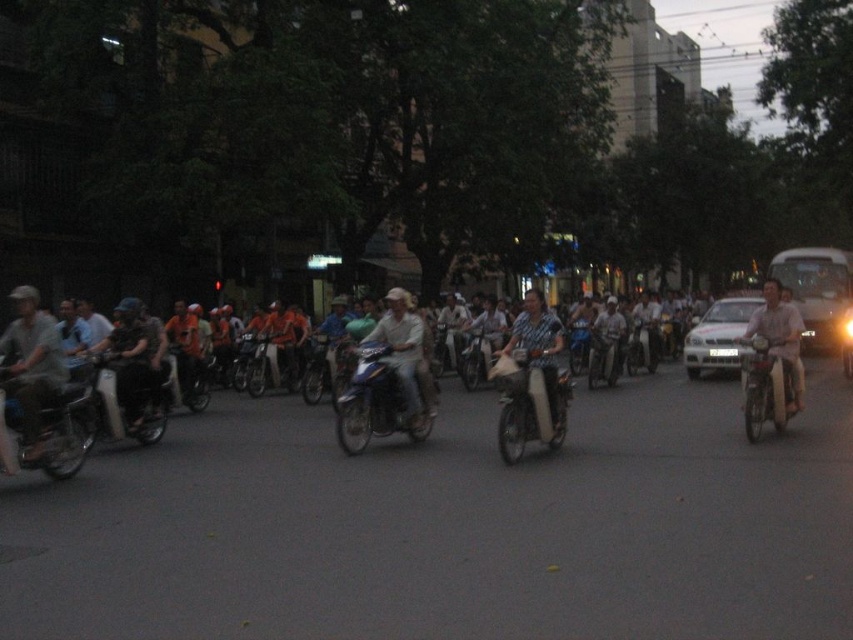
Who is positioned more to the right, white glossy sedan at center-right or light blue fabric shirt at center?

Positioned to the right is white glossy sedan at center-right.

Can you confirm if white glossy sedan at center-right is bigger than light blue fabric shirt at center?

Indeed, white glossy sedan at center-right has a larger size compared to light blue fabric shirt at center.

The width and height of the screenshot is (853, 640). What are the coordinates of `white glossy sedan at center-right` in the screenshot? It's located at (718, 336).

I want to click on white glossy sedan at center-right, so click(x=718, y=336).

Who is lower down, matte gray helmet at left or white glossy sedan at center-right?

Positioned lower is matte gray helmet at left.

The width and height of the screenshot is (853, 640). Describe the element at coordinates (32, 365) in the screenshot. I see `matte gray helmet at left` at that location.

Between point (26, 305) and point (689, 374), which one is positioned behind?

The point (689, 374) is behind.

Locate an element on the screen. matte gray helmet at left is located at coordinates tap(32, 365).

Who is more distant from viewer, (22,298) or (781,360)?

Positioned behind is point (781,360).

Image resolution: width=853 pixels, height=640 pixels. Describe the element at coordinates (32, 365) in the screenshot. I see `matte gray helmet at left` at that location.

Identify the location of matte gray helmet at left. The image size is (853, 640). (32, 365).